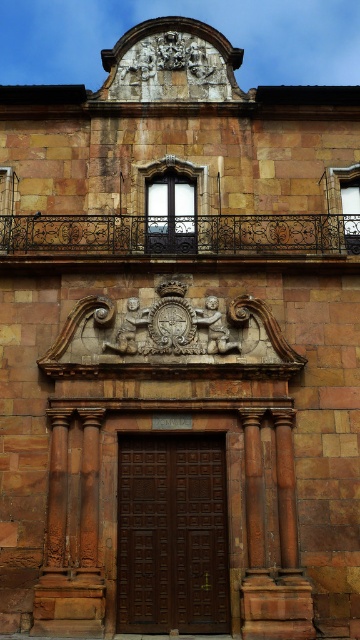
Question: Can you confirm if dark brown wood door at center is thinner than black wrought iron balcony at upper center?

Choices:
 (A) yes
 (B) no

Answer: (A)

Question: Can you confirm if dark brown wood door at center is positioned above black wrought iron balcony at upper center?

Choices:
 (A) yes
 (B) no

Answer: (B)

Question: Is dark brown wood door at center wider than black wrought iron balcony at upper center?

Choices:
 (A) yes
 (B) no

Answer: (B)

Question: Which object appears closest to the camera in this image?

Choices:
 (A) black wrought iron balcony at upper center
 (B) dark brown wood door at center

Answer: (B)